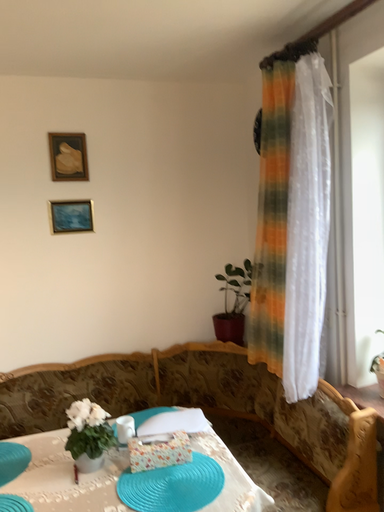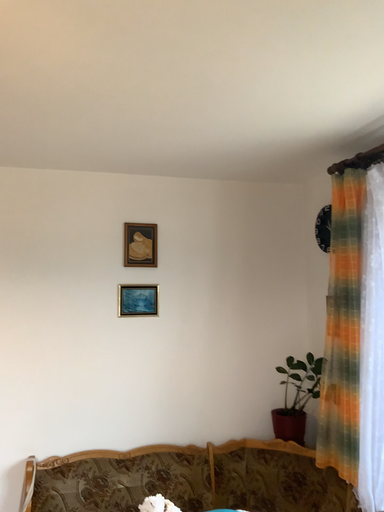
Question: Which way did the camera rotate in the video?

Choices:
 (A) rotated downward
 (B) rotated upward

Answer: (B)